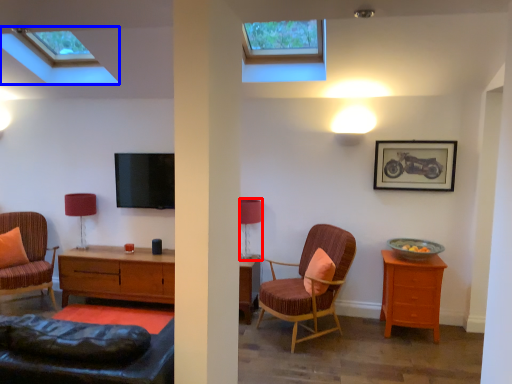
Question: Which object appears closest to the camera in this image, table lamp (highlighted by a red box) or window (highlighted by a blue box)?

Choices:
 (A) table lamp
 (B) window

Answer: (B)